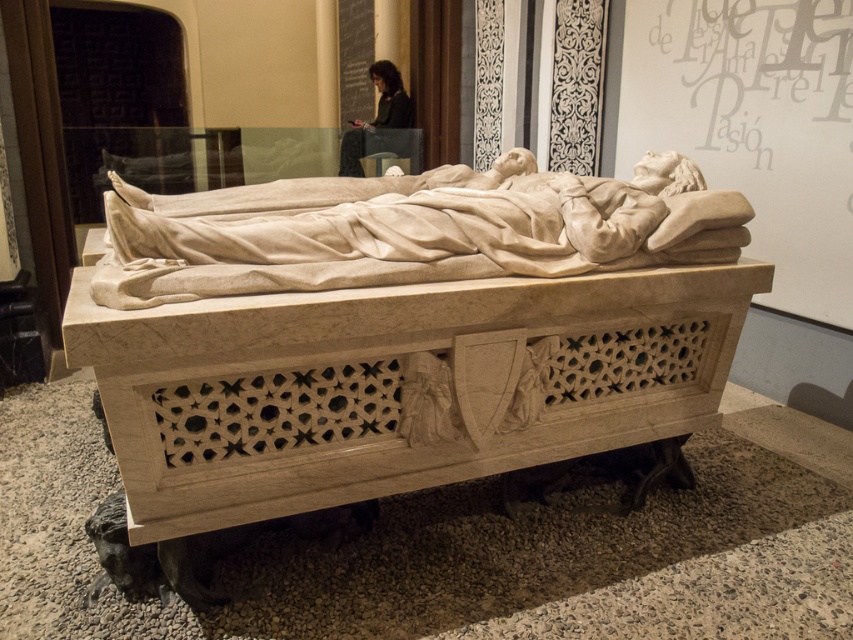
Question: Considering the real-world distances, which object is closest to the white marble statue at center?

Choices:
 (A) dark hair person at upper center
 (B) white marble bed at center

Answer: (B)

Question: Can you confirm if white marble bed at center is positioned above white marble statue at center?

Choices:
 (A) no
 (B) yes

Answer: (A)

Question: Which of the following is the closest to the observer?

Choices:
 (A) (664, 212)
 (B) (485, 392)
 (C) (389, 122)

Answer: (B)

Question: Which object appears farthest from the camera in this image?

Choices:
 (A) white marble statue at center
 (B) white marble bed at center
 (C) dark hair person at upper center

Answer: (C)

Question: Can you confirm if white marble bed at center is wider than white marble statue at center?

Choices:
 (A) yes
 (B) no

Answer: (A)

Question: Does white marble bed at center have a smaller size compared to dark hair person at upper center?

Choices:
 (A) no
 (B) yes

Answer: (A)